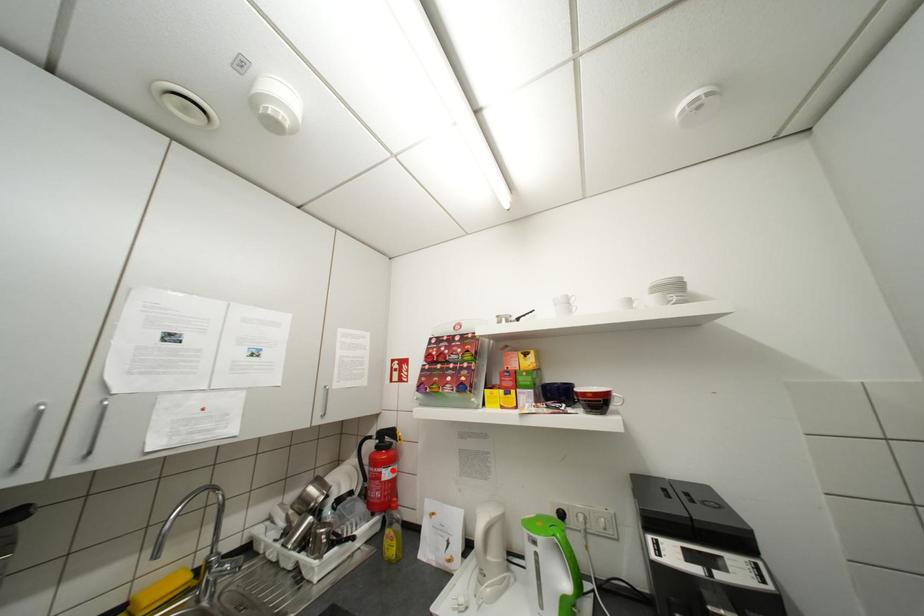
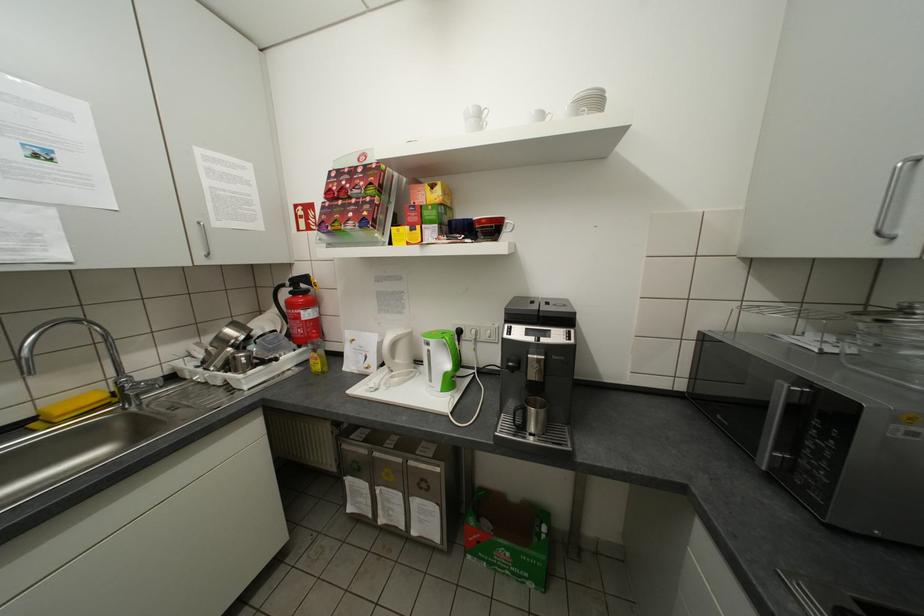
The point at the highlighted location is marked in the first image. Where is the corresponding point in the second image?

(310, 312)